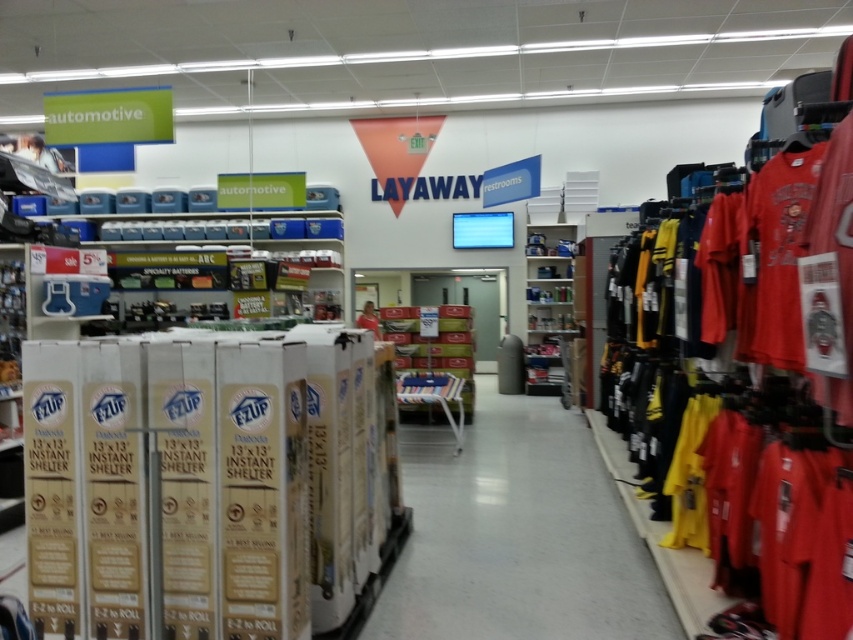
Question: Does yellow fabric at center appear on the right side of metallic silver shelves at center?

Choices:
 (A) no
 (B) yes

Answer: (A)

Question: Is matte red t-shirt at right bigger than metallic silver shelves at center?

Choices:
 (A) yes
 (B) no

Answer: (B)

Question: Can you confirm if yellow fabric at center is smaller than metallic silver shelves at center?

Choices:
 (A) yes
 (B) no

Answer: (A)

Question: Which of these objects is positioned closest to the metallic silver shelves at center?

Choices:
 (A) yellow fabric at center
 (B) matte red t-shirt at right

Answer: (A)

Question: Which point is closer to the camera?

Choices:
 (A) yellow fabric at center
 (B) matte red t-shirt at right

Answer: (B)

Question: Which object is positioned farthest from the metallic silver shelves at center?

Choices:
 (A) matte red t-shirt at right
 (B) yellow fabric at center

Answer: (A)